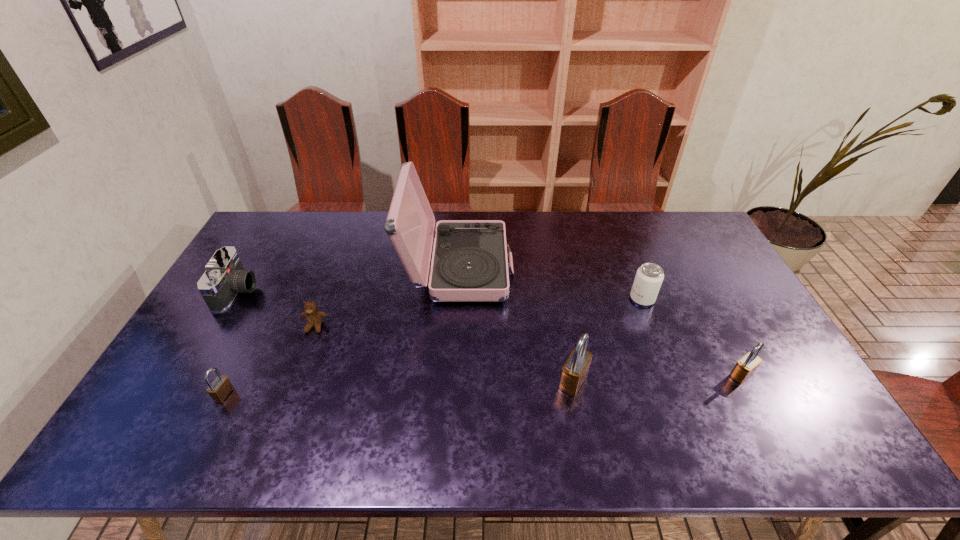
Locate an element on the screen. free space between the second tallest object and the soda can is located at coordinates (608, 340).

Identify which object is the fourth closest to the shortest padlock. Please provide its 2D coordinates. Your answer should be formatted as a tuple, i.e. [(x, y)], where the tuple contains the x and y coordinates of a point satisfying the conditions above.

[(575, 370)]

The height and width of the screenshot is (540, 960). I want to click on object identified as the closest to the fourth nearest object, so click(469, 263).

Where is `padlock identified as the third closest to the fifth object from right to left`? The image size is (960, 540). padlock identified as the third closest to the fifth object from right to left is located at coordinates (746, 366).

Choose which padlock is the nearest neighbor to the second object from right to left. Please provide its 2D coordinates. Your answer should be formatted as a tuple, i.e. [(x, y)], where the tuple contains the x and y coordinates of a point satisfying the conditions above.

[(746, 366)]

At what (x,y) coordinates should I click in order to perform the action: click on free spot that satisfies the following two spatial constraints: 1. on the front-facing side of the leftmost padlock; 2. on the right side of the leftmost object. Please return your answer as a coordinate pair (x, y). This screenshot has height=540, width=960. Looking at the image, I should click on (177, 395).

You are a GUI agent. You are given a task and a screenshot of the screen. Output one action in this format:
    pyautogui.click(x=<x>, y=<y>)
    Task: Click on the free location that satisfies the following two spatial constraints: 1. with the lid open on the tallest object; 2. on the back side of the second padlock from right to left
    The image size is (960, 540).
    Given the screenshot: What is the action you would take?
    pyautogui.click(x=452, y=381)

Locate an element on the screen. This screenshot has height=540, width=960. vacant space that satisfies the following two spatial constraints: 1. with the lid open on the tallest object; 2. at the face of the third object from left to right is located at coordinates (455, 327).

Where is `vacant space that satisfies the following two spatial constraints: 1. with the lid open on the fourth object from left to right; 2. at the face of the fourth farthest object`? The image size is (960, 540). vacant space that satisfies the following two spatial constraints: 1. with the lid open on the fourth object from left to right; 2. at the face of the fourth farthest object is located at coordinates (455, 327).

Find the location of `vacant space that satisfies the following two spatial constraints: 1. on the front-facing side of the leftmost object; 2. on the right side of the second object from right to left`. vacant space that satisfies the following two spatial constraints: 1. on the front-facing side of the leftmost object; 2. on the right side of the second object from right to left is located at coordinates (233, 299).